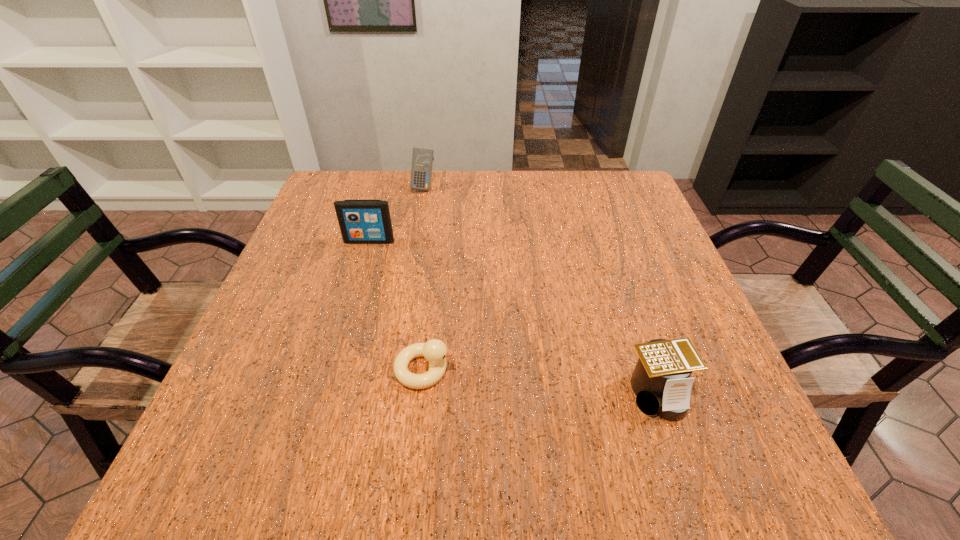
Where is `free space at the near right corner of the desktop`? free space at the near right corner of the desktop is located at coordinates (740, 454).

Identify the location of free spot between the farther calculator and the leftmost object. (396, 214).

The width and height of the screenshot is (960, 540). Find the location of `free space between the shortest object and the farthest object`. free space between the shortest object and the farthest object is located at coordinates (424, 278).

At what (x,y) coordinates should I click in order to perform the action: click on free space between the duckling and the farther calculator. Please return your answer as a coordinate pair (x, y). The height and width of the screenshot is (540, 960). Looking at the image, I should click on (424, 278).

Locate an element on the screen. The width and height of the screenshot is (960, 540). vacant area between the taller calculator and the nearer calculator is located at coordinates (540, 290).

Find the location of `free spot between the duckling and the right calculator`. free spot between the duckling and the right calculator is located at coordinates (541, 381).

Locate an element on the screen. free space that is in between the farther calculator and the iPod is located at coordinates (396, 214).

Locate an element on the screen. The height and width of the screenshot is (540, 960). empty space between the iPod and the duckling is located at coordinates (396, 305).

Locate an element on the screen. The width and height of the screenshot is (960, 540). free spot between the third nearest object and the shorter calculator is located at coordinates (514, 317).

Image resolution: width=960 pixels, height=540 pixels. I want to click on free space between the duckling and the left calculator, so click(x=424, y=278).